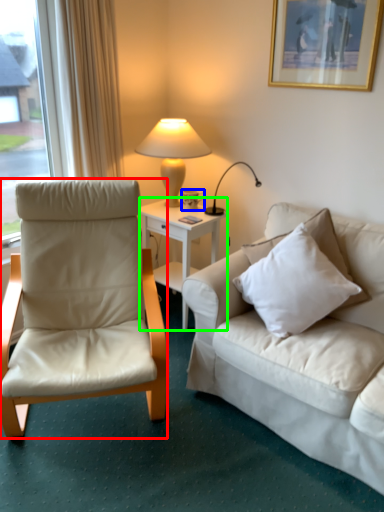
Question: Based on their relative distances, which object is nearer to chair (highlighted by a red box)? Choose from coffee cup (highlighted by a blue box) and desk (highlighted by a green box).

Choices:
 (A) coffee cup
 (B) desk

Answer: (B)